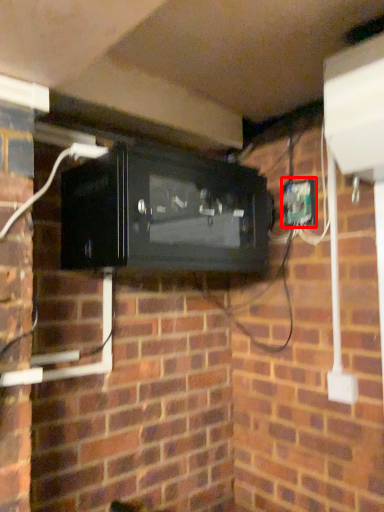
Question: Where is electric outlet (annotated by the red box) located in relation to appliance in the image?

Choices:
 (A) right
 (B) left

Answer: (A)